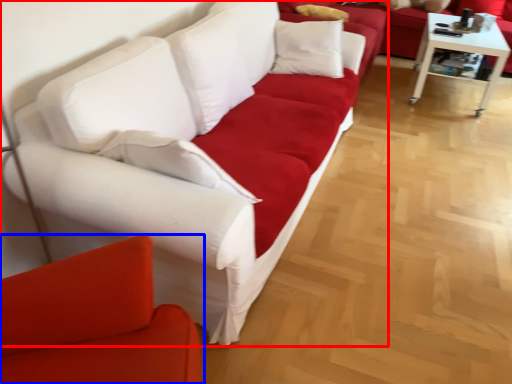
Question: Which point is further to the camera, studio couch (highlighted by a red box) or studio couch (highlighted by a blue box)?

Choices:
 (A) studio couch
 (B) studio couch

Answer: (A)